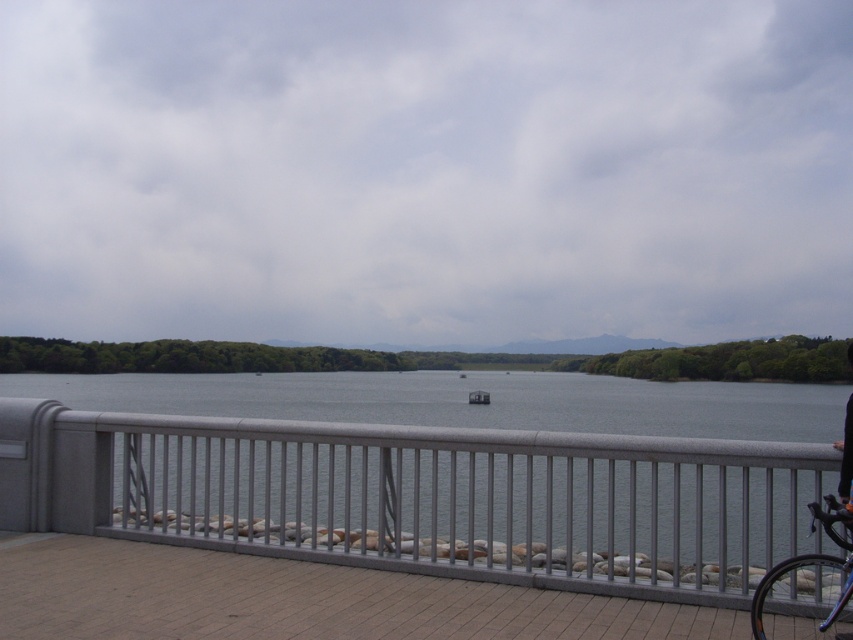
Question: Among these points, which one is nearest to the camera?

Choices:
 (A) pos(769,627)
 (B) pos(733,486)

Answer: (A)

Question: Which object appears closest to the camera in this image?

Choices:
 (A) shiny black bicycle at right
 (B) satin silver railing at center

Answer: (A)

Question: Does satin silver railing at center appear under shiny black bicycle at right?

Choices:
 (A) yes
 (B) no

Answer: (B)

Question: Does satin silver railing at center appear on the right side of shiny black bicycle at right?

Choices:
 (A) no
 (B) yes

Answer: (A)

Question: Does satin silver railing at center have a lesser width compared to shiny black bicycle at right?

Choices:
 (A) no
 (B) yes

Answer: (A)